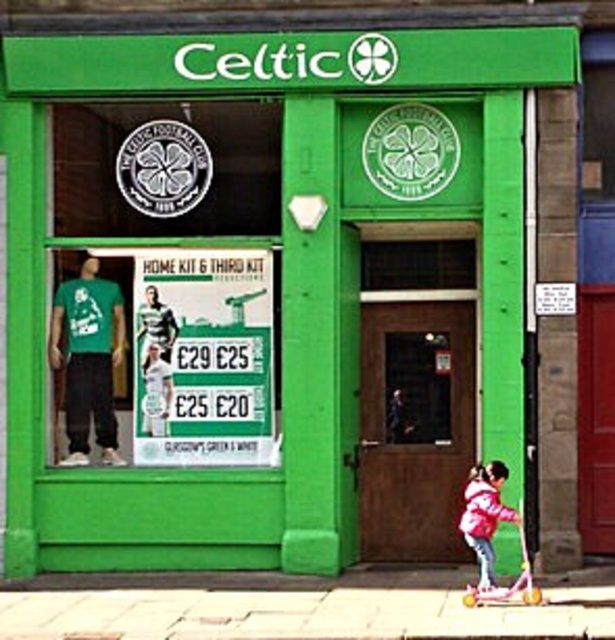
Question: Is paved stone pavement at lower center further to the viewer compared to pink fabric jacket at lower right?

Choices:
 (A) no
 (B) yes

Answer: (A)

Question: Does paved stone pavement at lower center appear on the right side of pink fabric jacket at lower right?

Choices:
 (A) yes
 (B) no

Answer: (A)

Question: Which point is closer to the camera?

Choices:
 (A) (159, 596)
 (B) (478, 492)

Answer: (B)

Question: Which object appears closest to the camera in this image?

Choices:
 (A) pink fabric jacket at lower right
 (B) paved stone pavement at lower center

Answer: (B)

Question: Can you confirm if paved stone pavement at lower center is wider than pink fabric jacket at lower right?

Choices:
 (A) no
 (B) yes

Answer: (B)